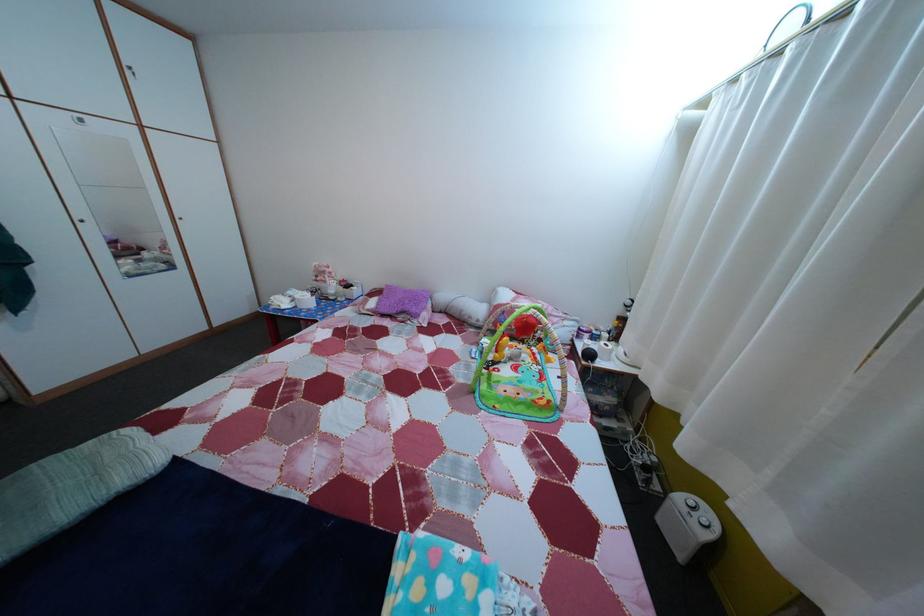
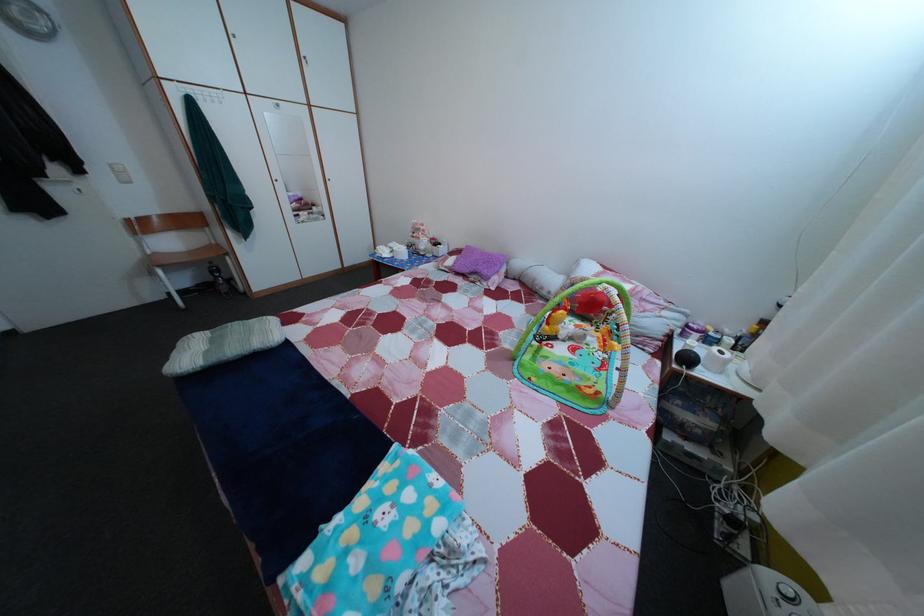
Question: The images are taken continuously from a first-person perspective. In which direction are you moving?

Choices:
 (A) Left
 (B) Right
 (C) Forward
 (D) Backward

Answer: (B)